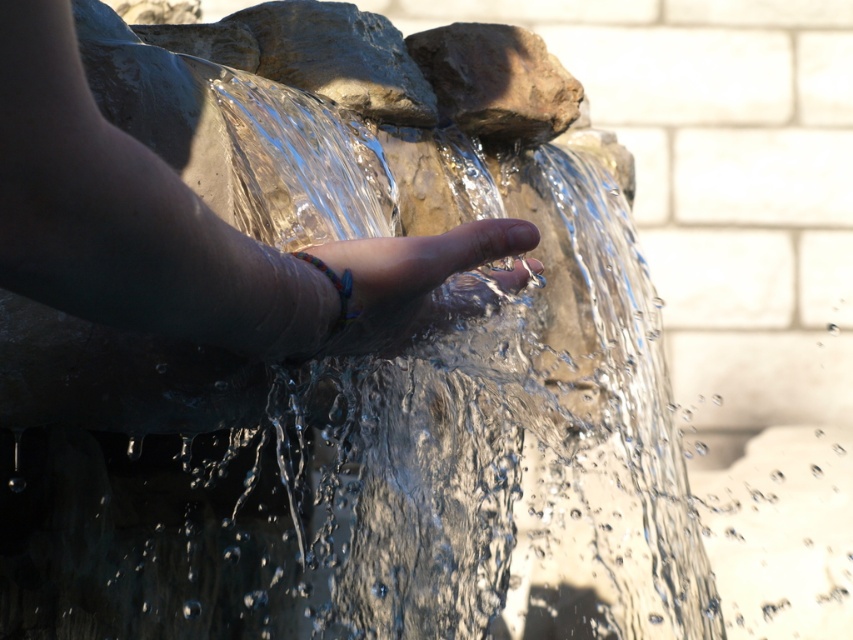
In the scene shown: You are standing in front of the fountain and see two points marked in the image. Which point, point (218, 340) or point (345, 284), is closer to you?

Point (218, 340) is closer to you than point (345, 284).

You are standing near the stone fountain and notice the multicolored beaded bracelet at center and the rough stone at center. Which object is shorter in height?

The multicolored beaded bracelet at center has a lesser height compared to the rough stone at center, so the bracelet is shorter.